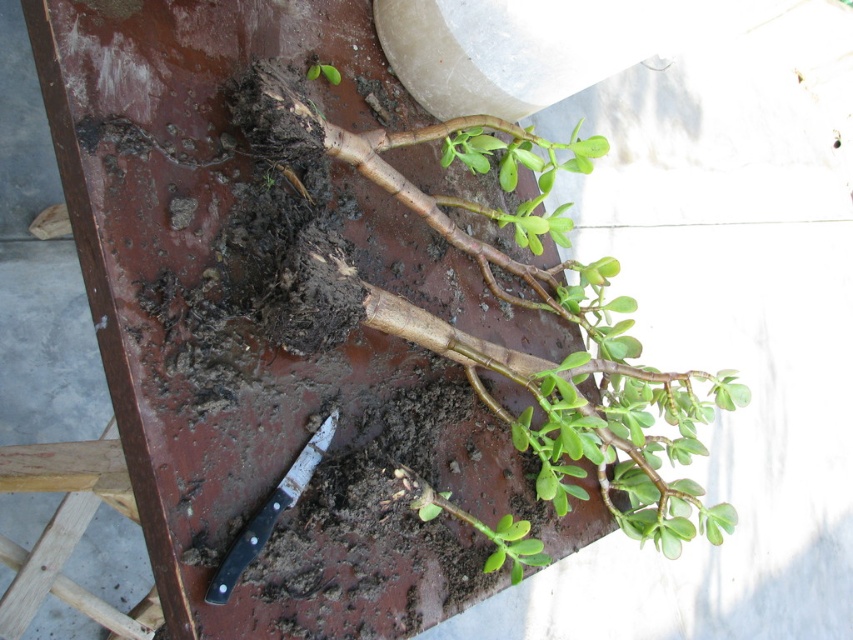
Question: Which object appears closest to the camera in this image?

Choices:
 (A) black plastic knife at lower left
 (B) dull brown soil at center

Answer: (A)

Question: Among these points, which one is farthest from the camera?

Choices:
 (A) (195, 490)
 (B) (322, 456)
 (C) (281, 97)

Answer: (B)

Question: Is dull brown soil at center positioned at the back of black plastic knife at lower left?

Choices:
 (A) yes
 (B) no

Answer: (A)

Question: Can you confirm if green matte plant at center is positioned to the left of black plastic knife at lower left?

Choices:
 (A) no
 (B) yes

Answer: (A)

Question: Which object appears closest to the camera in this image?

Choices:
 (A) green matte plant at center
 (B) black plastic knife at lower left
 (C) dull brown soil at center

Answer: (B)

Question: Can you confirm if dull brown soil at center is positioned below green matte plant at center?

Choices:
 (A) yes
 (B) no

Answer: (A)